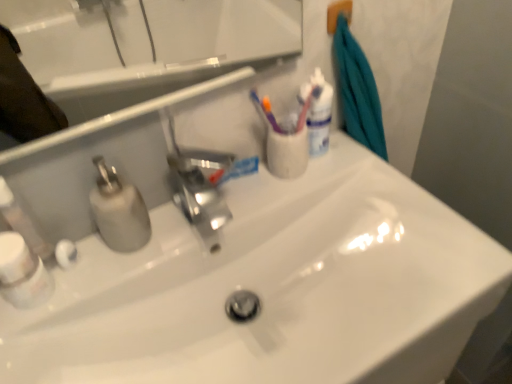
Question: Considering the positions of point (13, 238) and point (24, 213), is point (13, 238) closer or farther from the camera than point (24, 213)?

Choices:
 (A) farther
 (B) closer

Answer: (B)

Question: Based on their sizes in the image, would you say white plastic bottle at lower left, arranged as the second mouthwash when viewed from the back, is bigger or smaller than white plastic soap dispenser at left?

Choices:
 (A) small
 (B) big

Answer: (B)

Question: Which object is positioned farthest from the white glossy mouthwash at upper right, which is counted as the first mouthwash, starting from the back?

Choices:
 (A) white plastic soap dispenser at left
 (B) white glossy toothpaste at center
 (C) white glossy sink at center
 (D) white plastic bottle at lower left, arranged as the first mouthwash when ordered from the bottom

Answer: (D)

Question: Which of these objects is positioned closest to the white glossy sink at center?

Choices:
 (A) white plastic bottle at lower left, arranged as the first mouthwash when ordered from the bottom
 (B) white glossy mouthwash at upper right, the second mouthwash when ordered from left to right
 (C) white plastic soap dispenser at left
 (D) white glossy toothpaste at center

Answer: (D)